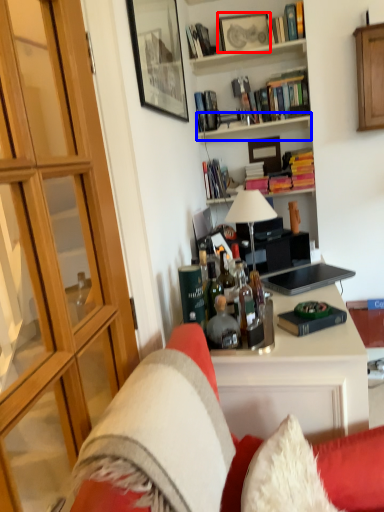
Question: Which object appears closest to the camera in this image, picture frame (highlighted by a red box) or shelf (highlighted by a blue box)?

Choices:
 (A) picture frame
 (B) shelf

Answer: (B)